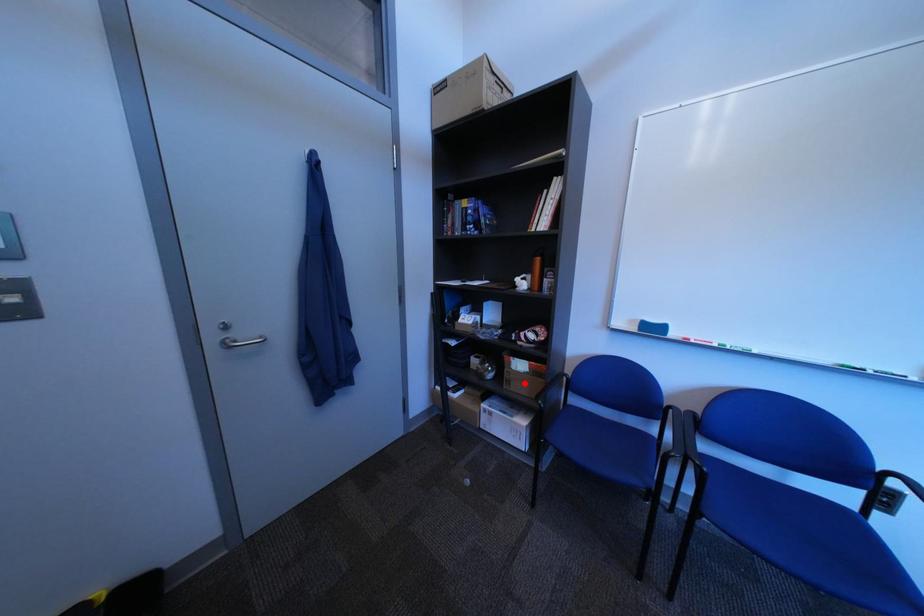
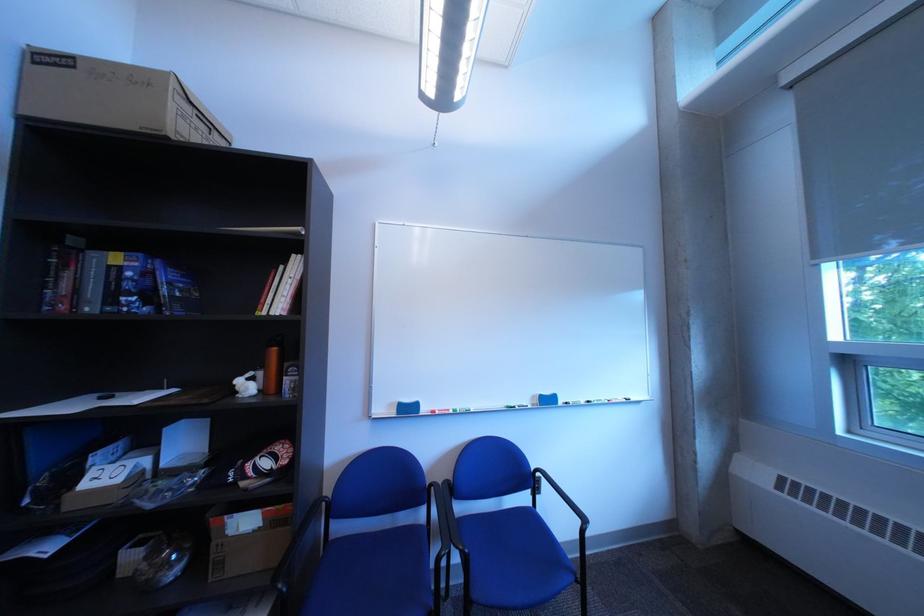
In the second image, find the point that corresponds to the highlighted location in the first image.

(237, 565)